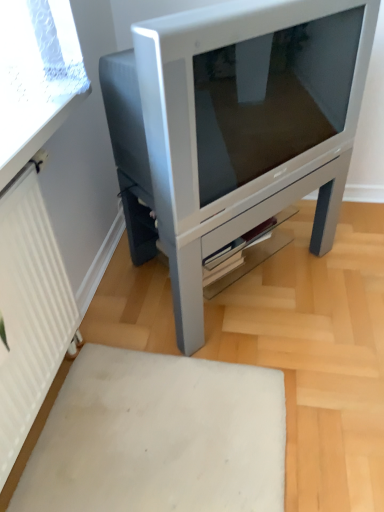
Find the location of a particular element. Image resolution: width=384 pixels, height=512 pixels. free spot in front of white ribbed radiator at left is located at coordinates (78, 461).